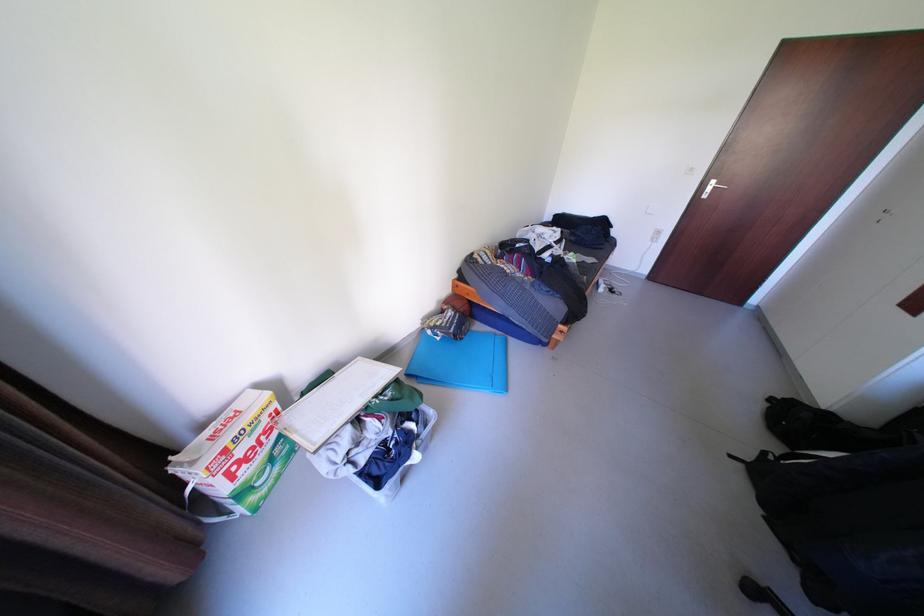
The location [377,448] corresponds to which object?

It corresponds to the plastic storage bin in the image.